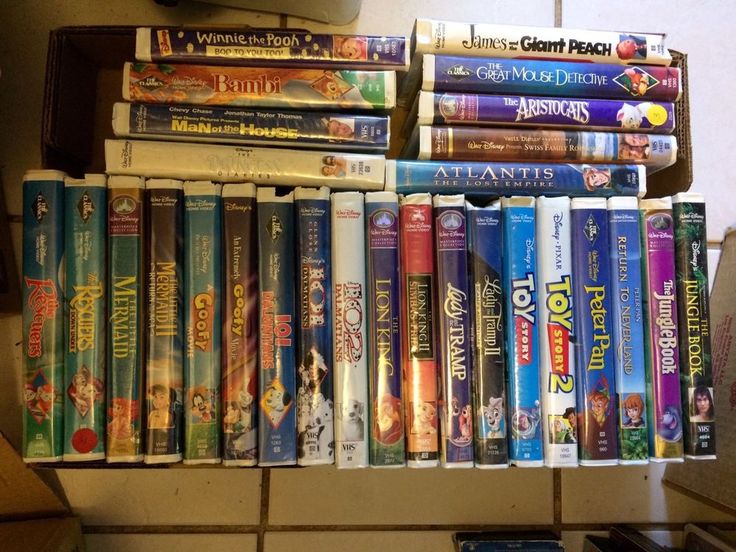
Find the location of `vhs boxes stacked on top of the others`. vhs boxes stacked on top of the others is located at coordinates (283, 47), (286, 84), (294, 121), (297, 153), (514, 38), (509, 76), (509, 103), (498, 136), (489, 169).